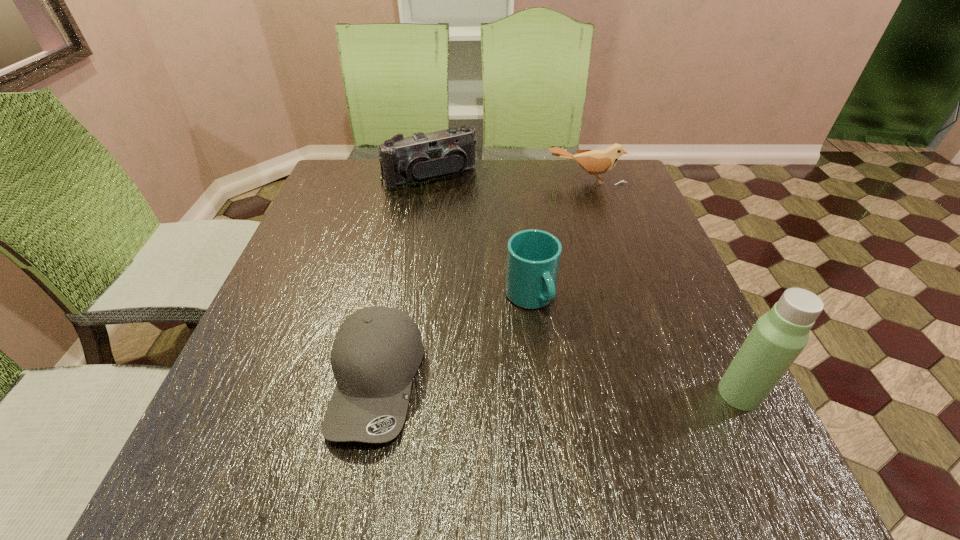
The width and height of the screenshot is (960, 540). What are the coordinates of `baseball cap` in the screenshot? It's located at coord(377,350).

At what (x,y) coordinates should I click in order to perform the action: click on the tallest object. Please return your answer as a coordinate pair (x, y). The width and height of the screenshot is (960, 540). Looking at the image, I should click on (778, 337).

This screenshot has height=540, width=960. I want to click on camcorder, so click(x=420, y=157).

This screenshot has height=540, width=960. In order to click on bird in this screenshot , I will do `click(595, 162)`.

The image size is (960, 540). I want to click on the third object from right to left, so click(x=533, y=256).

What are the coordinates of `the third farthest object` in the screenshot? It's located at (533, 256).

Identify the location of vacant space positioned on the left of the tallest object. (622, 394).

I want to click on free spot located 0.360m on the front-facing side of the camcorder, so click(x=502, y=269).

Find the location of a particular element. Image resolution: width=960 pixels, height=540 pixels. vacant position located 0.230m on the front-facing side of the camcorder is located at coordinates (480, 237).

I want to click on free region located 0.110m on the front-facing side of the camcorder, so click(462, 211).